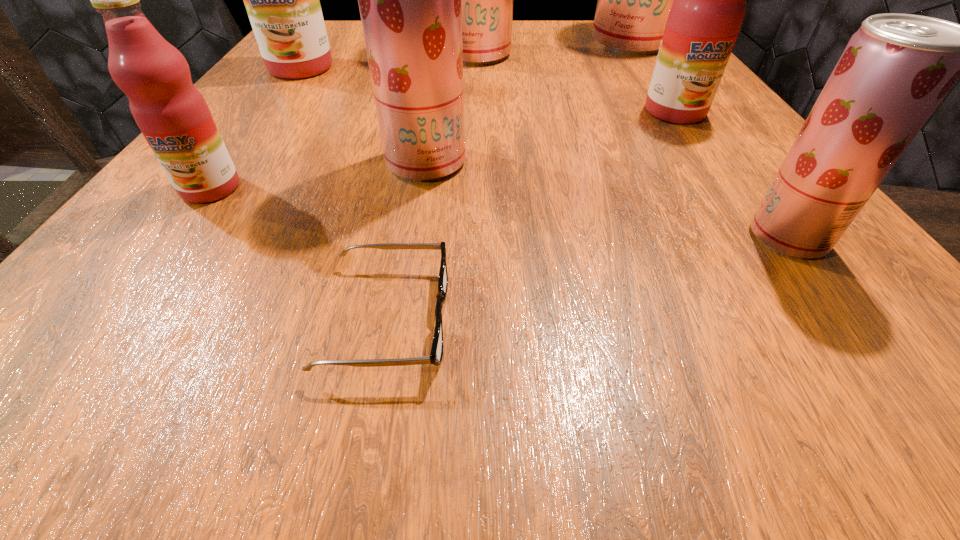
You are a GUI agent. You are given a task and a screenshot of the screen. Output one action in this format:
    pyautogui.click(x=<x>, y=<y>)
    Task: Click on the black spectacles
    
    Given the screenshot: What is the action you would take?
    pyautogui.click(x=436, y=355)

Where is `spectacles`? The image size is (960, 540). spectacles is located at coordinates (436, 355).

Where is `vacant area situated 0.090m on the front of the biggest strawberry fruit juice`? This screenshot has width=960, height=540. vacant area situated 0.090m on the front of the biggest strawberry fruit juice is located at coordinates (652, 75).

What are the coordinates of `free space located on the left of the third smallest strawberry fruit juice` in the screenshot? It's located at (x=303, y=54).

Identify the location of free space located on the label of the farthest pink fruit juice. This screenshot has width=960, height=540. 230,166.

Locate an element on the screen. free region located 0.150m on the back of the third farthest strawberry fruit juice is located at coordinates (436, 98).

Identify the location of blank space located on the label of the fifth nearest object. This screenshot has width=960, height=540. (732, 197).

Where is `free space located 0.220m on the back of the seventh farthest object`? The width and height of the screenshot is (960, 540). free space located 0.220m on the back of the seventh farthest object is located at coordinates (708, 128).

The image size is (960, 540). I want to click on free space located 0.180m on the label of the nearest pink fruit juice, so click(116, 317).

At what (x,y) coordinates should I click in order to perform the action: click on vacant space located on the front-facing side of the black spectacles. Please return your answer as a coordinate pair (x, y). Image resolution: width=960 pixels, height=540 pixels. Looking at the image, I should click on (724, 318).